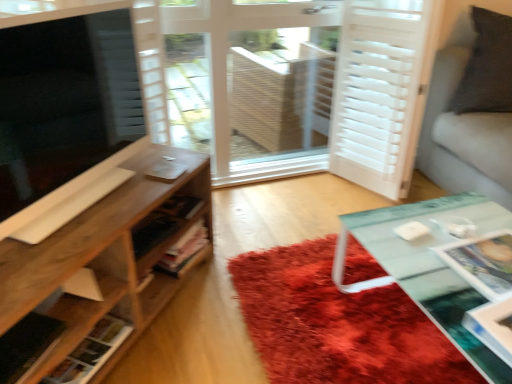
Question: From the image's perspective, is shaggy red rug at center located above or below white matte screen door at right, the 2th screen door in the left-to-right sequence?

Choices:
 (A) above
 (B) below

Answer: (B)

Question: Looking at their shapes, would you say shaggy red rug at center is wider or thinner than white matte screen door at right, positioned as the 1th screen door in right-to-left order?

Choices:
 (A) thin
 (B) wide

Answer: (B)

Question: Considering the real-world distances, which object is farthest from the wooden shelf at lower left, marked as the first shelf in a bottom-to-top arrangement?

Choices:
 (A) matte black tv at left
 (B) white matte screen door at right, positioned as the 1th screen door in right-to-left order
 (C) dark gray fabric couch at upper right
 (D) shaggy red rug at center
 (E) white wooden screen door at center, marked as the second screen door in a right-to-left arrangement

Answer: (E)

Question: Which object is positioned closest to the dark gray fabric couch at upper right?

Choices:
 (A) white matte screen door at right, positioned as the 1th screen door in right-to-left order
 (B) wooden shelf at left, the second shelf when ordered from bottom to top
 (C) wooden shelf at lower left, which is the second shelf in top-to-bottom order
 (D) shaggy red rug at center
 (E) white wooden screen door at center, arranged as the 1th screen door when viewed from the left

Answer: (A)